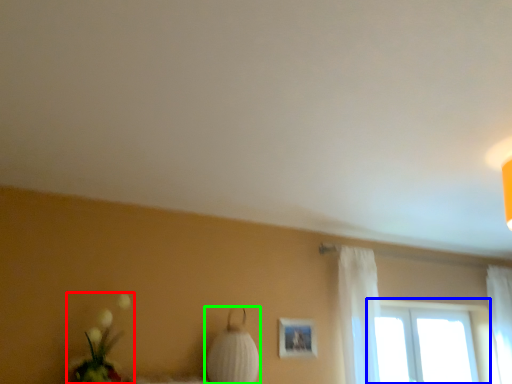
Question: Estimate the real-world distances between objects in this image. Which object is farther from floral arrangement (highlighted by a red box), window (highlighted by a blue box) or table lamp (highlighted by a green box)?

Choices:
 (A) window
 (B) table lamp

Answer: (A)